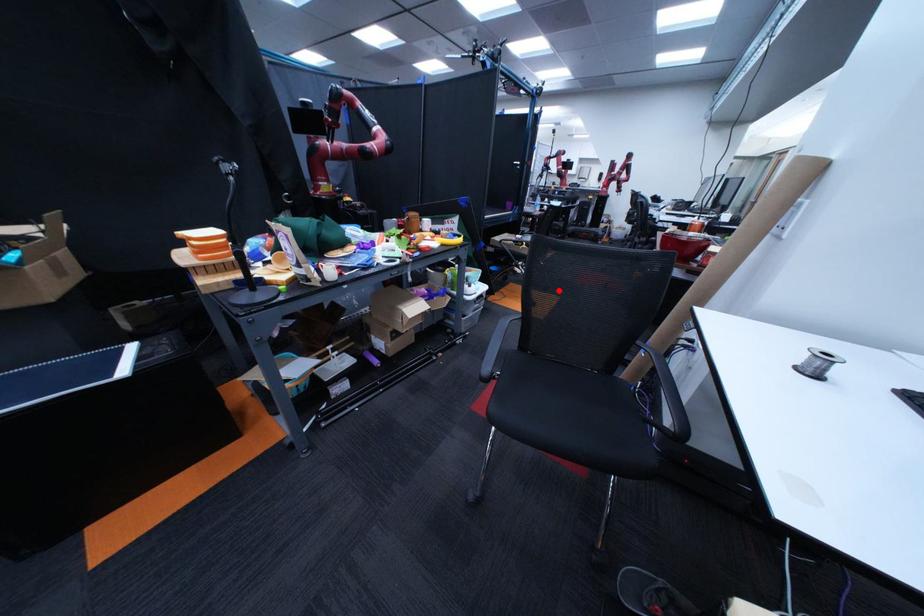
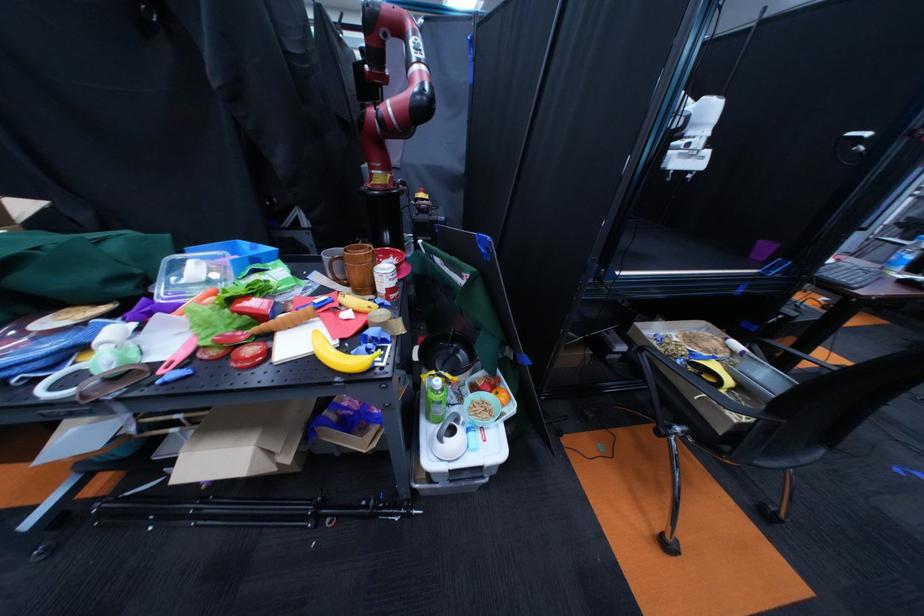
Find the pixel in the second image that matches the highlighted location in the first image.

(776, 517)